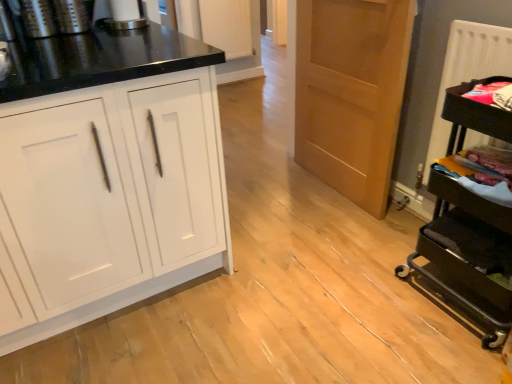
Question: Is white textured radiator at right facing away from white glossy paper towel dispenser at upper center, the 3th appliance in the left-to-right sequence?

Choices:
 (A) yes
 (B) no

Answer: (B)

Question: Is white textured radiator at right beside white glossy paper towel dispenser at upper center, the 3th appliance in the left-to-right sequence?

Choices:
 (A) yes
 (B) no

Answer: (B)

Question: Can you confirm if white textured radiator at right is thinner than white glossy paper towel dispenser at upper center, the 3th appliance in the left-to-right sequence?

Choices:
 (A) yes
 (B) no

Answer: (B)

Question: Considering the relative positions of white textured radiator at right and white glossy paper towel dispenser at upper center, the 4th appliance when ordered from bottom to top, in the image provided, is white textured radiator at right to the right of white glossy paper towel dispenser at upper center, the 4th appliance when ordered from bottom to top, from the viewer's perspective?

Choices:
 (A) yes
 (B) no

Answer: (A)

Question: Is white textured radiator at right outside white glossy paper towel dispenser at upper center, the 4th appliance when ordered from bottom to top?

Choices:
 (A) yes
 (B) no

Answer: (A)

Question: Based on their sizes in the image, would you say white textured radiator at right is bigger or smaller than white glossy cabinet at left?

Choices:
 (A) big
 (B) small

Answer: (B)

Question: In terms of height, does white textured radiator at right look taller or shorter compared to white glossy cabinet at left?

Choices:
 (A) tall
 (B) short

Answer: (B)

Question: Considering their positions, is white textured radiator at right located in front of or behind white glossy cabinet at left?

Choices:
 (A) front
 (B) behind

Answer: (B)

Question: Would you say white textured radiator at right is inside or outside white glossy cabinet at left?

Choices:
 (A) outside
 (B) inside

Answer: (A)

Question: Based on their sizes in the image, would you say black metal cart at right, acting as the 4th appliance starting from the left, is bigger or smaller than light brown wood door at center?

Choices:
 (A) small
 (B) big

Answer: (B)

Question: From a real-world perspective, is black metal cart at right, the first appliance from the bottom, positioned above or below light brown wood door at center?

Choices:
 (A) above
 (B) below

Answer: (B)

Question: Is point (465, 253) positioned closer to the camera than point (404, 8)?

Choices:
 (A) farther
 (B) closer

Answer: (B)

Question: Based on their positions, is black metal cart at right, the first appliance from the bottom, located to the left or right of light brown wood door at center?

Choices:
 (A) left
 (B) right

Answer: (B)

Question: From the image's perspective, is white glossy cabinet at left located above or below white textured radiator at right?

Choices:
 (A) below
 (B) above

Answer: (A)

Question: From a real-world perspective, is white glossy cabinet at left positioned above or below white textured radiator at right?

Choices:
 (A) above
 (B) below

Answer: (B)